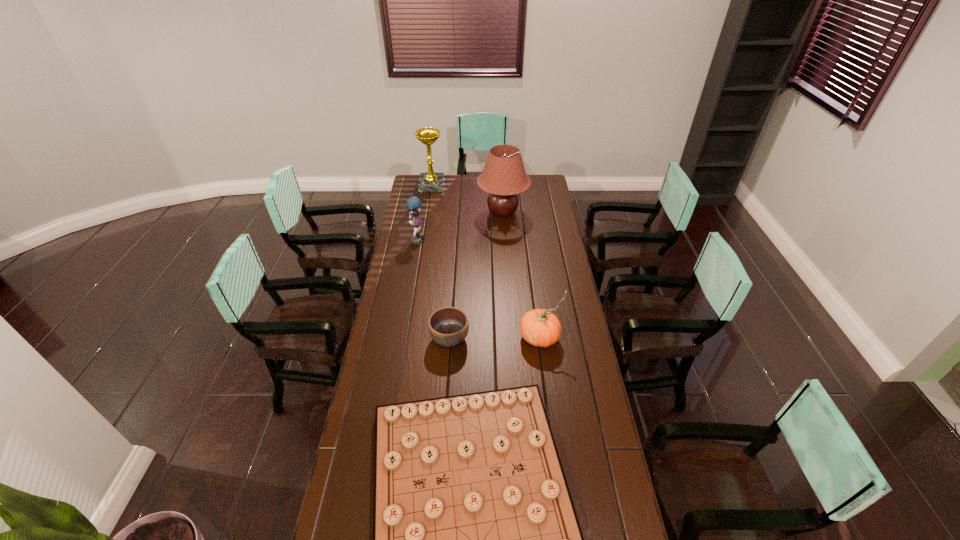
The width and height of the screenshot is (960, 540). I want to click on lampshade, so click(x=503, y=176).

Locate an element on the screen. award is located at coordinates (428, 182).

Identify the location of the fourth nearest object. This screenshot has width=960, height=540. (x=413, y=203).

Locate an element on the screen. pumpkin is located at coordinates pyautogui.click(x=539, y=327).

This screenshot has height=540, width=960. I want to click on the fifth tallest object, so click(448, 326).

The height and width of the screenshot is (540, 960). Identify the location of vacant space situated on the front-facing side of the fifth nearest object. (507, 271).

I want to click on vacant space situated on the front-facing side of the farthest object, so click(500, 185).

Locate an element on the screen. The image size is (960, 540). free space located on the front-facing side of the rag doll is located at coordinates (461, 238).

The width and height of the screenshot is (960, 540). I want to click on vacant space located 0.190m on the front of the pumpkin, so click(x=547, y=393).

The width and height of the screenshot is (960, 540). In order to click on free space located 0.310m on the right of the second shortest object in this screenshot , I will do `click(542, 339)`.